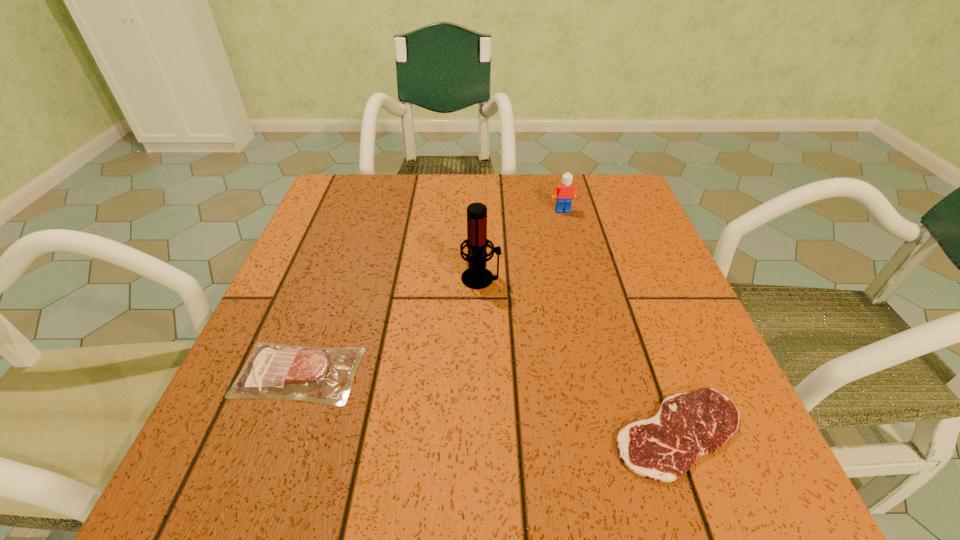
The image size is (960, 540). Identify the location of vacant space at the left edge of the desktop. (297, 274).

Where is `free space at the right edge of the desktop`? The width and height of the screenshot is (960, 540). free space at the right edge of the desktop is located at coordinates (606, 251).

You are a GUI agent. You are given a task and a screenshot of the screen. Output one action in this format:
    pyautogui.click(x=<x>, y=<y>)
    Task: Click on the free space at the near left corner of the desktop
    Image resolution: width=960 pixels, height=540 pixels.
    Given the screenshot: What is the action you would take?
    pyautogui.click(x=208, y=470)

What are the coordinates of `vacant region at the far right corner of the desktop` in the screenshot? It's located at (606, 185).

I want to click on free area in between the third object from right to left and the leftmost object, so click(390, 326).

Identify the location of vacant area that lies between the shorter steak and the third shortest object. The width and height of the screenshot is (960, 540). (621, 322).

Identify the location of free space between the third tallest object and the second tallest object. [x=431, y=292].

This screenshot has width=960, height=540. In order to click on free spot between the third shortest object and the second object from left to right in this screenshot , I will do `click(522, 245)`.

You are a GUI agent. You are given a task and a screenshot of the screen. Output one action in this format:
    pyautogui.click(x=<x>, y=<y>)
    Task: Click on the vacant point located between the second tallest object and the second farthest object
    
    Given the screenshot: What is the action you would take?
    pyautogui.click(x=522, y=245)

Identify the location of free space between the third shortest object and the third nearest object. This screenshot has height=540, width=960. (522, 245).